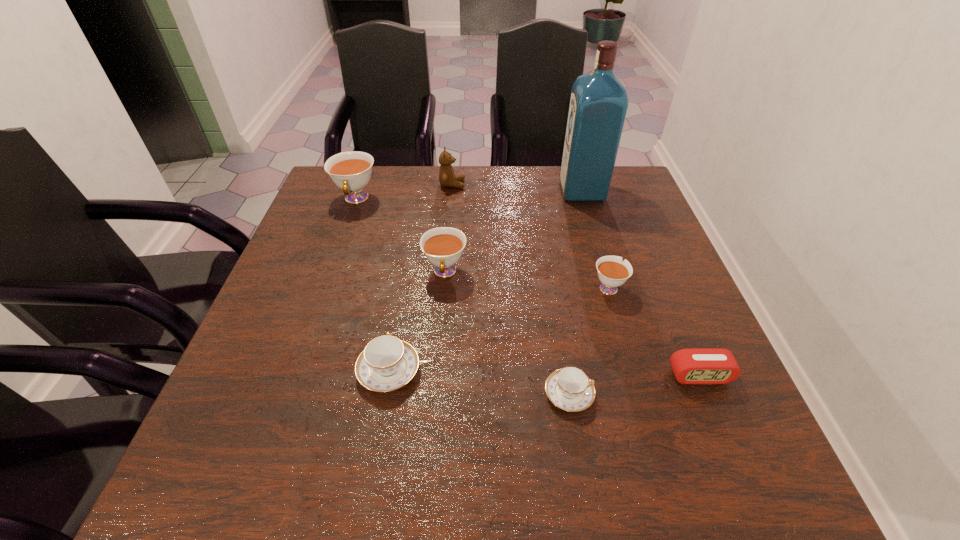
Where is `object that stands as the sixth closest to the bigger blue teacup`? The width and height of the screenshot is (960, 540). object that stands as the sixth closest to the bigger blue teacup is located at coordinates (447, 178).

Identify which object is the fifth nearest to the blue liquor. Please provide its 2D coordinates. Your answer should be formatted as a tuple, i.e. [(x, y)], where the tuple contains the x and y coordinates of a point satisfying the conditions above.

[(690, 366)]

Where is `teacup that is the fourth closest one to the fourth object from right to left`? The width and height of the screenshot is (960, 540). teacup that is the fourth closest one to the fourth object from right to left is located at coordinates (351, 171).

You are a GUI agent. You are given a task and a screenshot of the screen. Output one action in this format:
    pyautogui.click(x=<x>, y=<y>)
    Task: Click on the teacup that stands as the closest to the farthest white teacup
    Image resolution: width=960 pixels, height=540 pixels.
    Given the screenshot: What is the action you would take?
    pyautogui.click(x=443, y=246)

I want to click on white teacup that is the second closest to the leftmost teacup, so click(612, 272).

The width and height of the screenshot is (960, 540). In order to click on white teacup that is the second closest to the leftmost white teacup in this screenshot , I will do `click(612, 272)`.

The image size is (960, 540). Find the location of `vacant region that satisfies the following two spatial constraints: 1. on the front-facing side of the teddy bear; 2. on the side of the leftmost teacup with the handle`. vacant region that satisfies the following two spatial constraints: 1. on the front-facing side of the teddy bear; 2. on the side of the leftmost teacup with the handle is located at coordinates pyautogui.click(x=451, y=199).